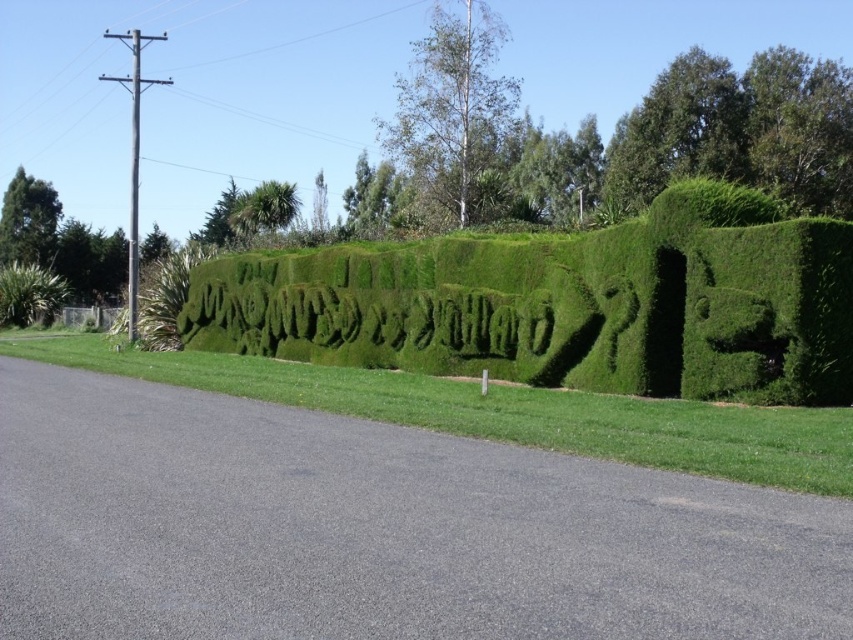
You are standing in front of the hedge sculpture and want to take a photo that includes both the point at coordinates point (357, 378) and the point at coordinates point (30, 305). Since you want the closer point to be in focus, which point should you focus on?

You should focus on point (357, 378) because it is closer to the camera than point (30, 305).

You are a landscape architect planning to install a new hedge sculpture in a park. You have two options from the image provided. Which one is bigger between the green grass hedge at center and the green hedge at center?

The green grass hedge at center is larger compared to the green hedge at center.